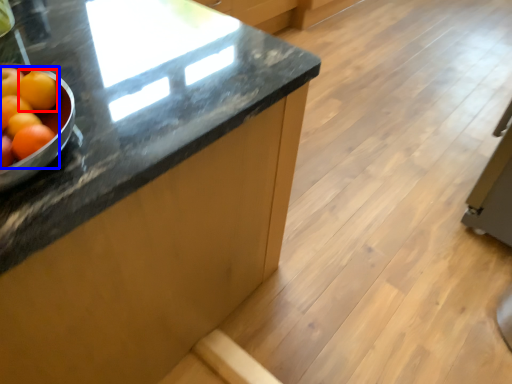
Question: Which object appears farthest to the camera in this image, tangerine (highlighted by a red box) or grapefruit (highlighted by a blue box)?

Choices:
 (A) tangerine
 (B) grapefruit

Answer: (A)